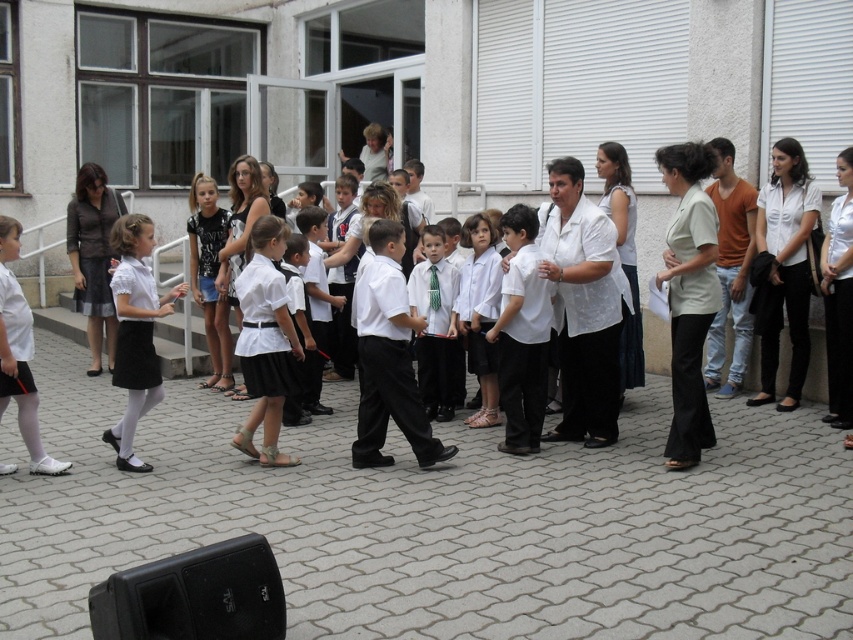
You are standing in front of the building with large windows and white shutters. You need to locate the white smooth shirt at center. Where exactly is it located in terms of coordinates?

The white smooth shirt at center is located at coordinates point (521, 333).

You are a photographer trying to capture a clear shot of both the beige fabric blouse at center and the white glossy shirt at center. Since you want to ensure both are visible, which one should you focus on first considering their sizes?

The beige fabric blouse at center is larger in size than the white glossy shirt at center, so you should focus on the beige fabric blouse at center first to ensure it is in clear view, then adjust for the smaller white glossy shirt at center.

You are a photographer trying to capture a clear shot of the beige fabric blouse at center and the white glossy shirt at center. Which one is positioned higher in the frame?

The beige fabric blouse at center is above the white glossy shirt at center, so it is positioned higher in the frame.